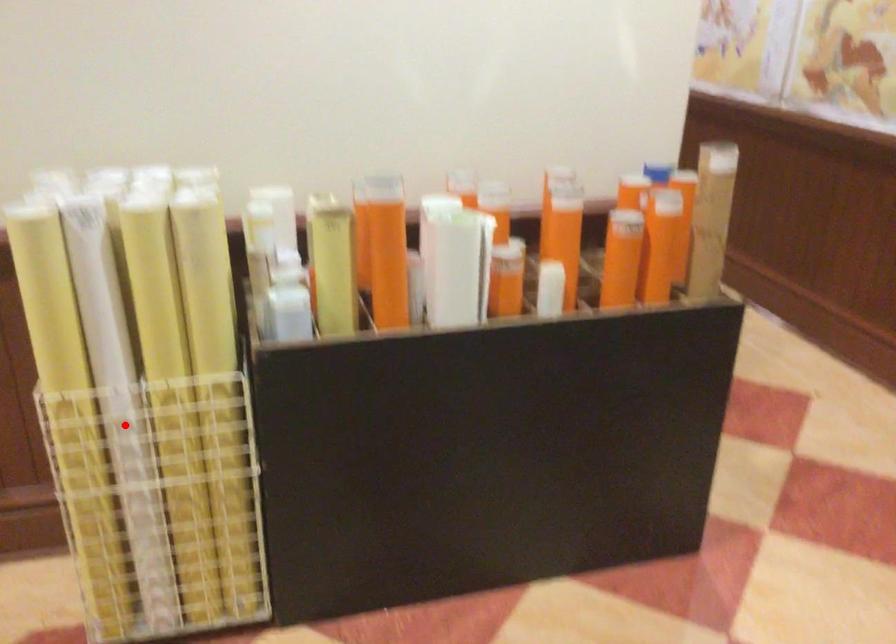
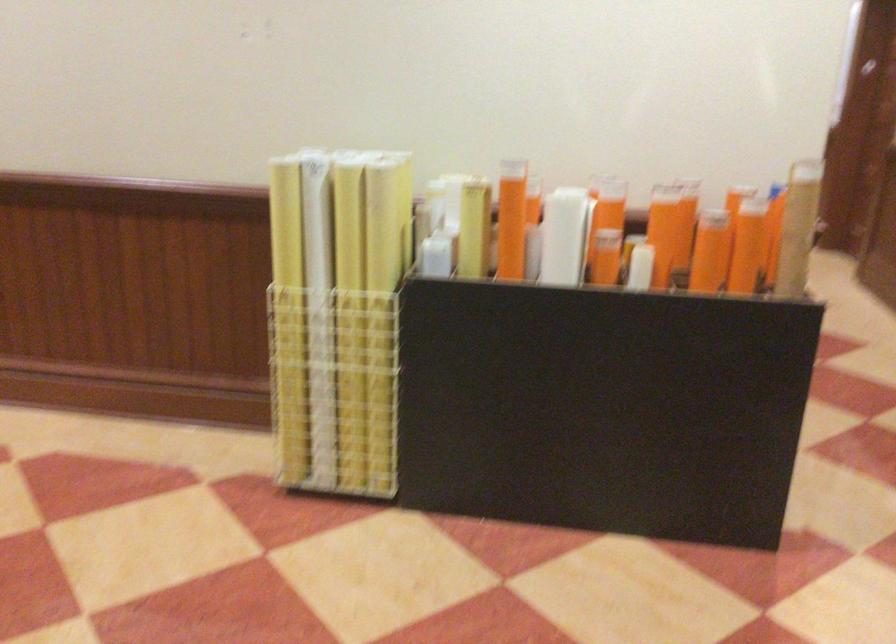
Question: A red point is marked in image1. In image2, is the corresponding 3D point closer to the camera or farther? Reply with the corresponding letter.

Choices:
 (A) The corresponding 3D point is closer.
 (B) The corresponding 3D point is farther.

Answer: (B)